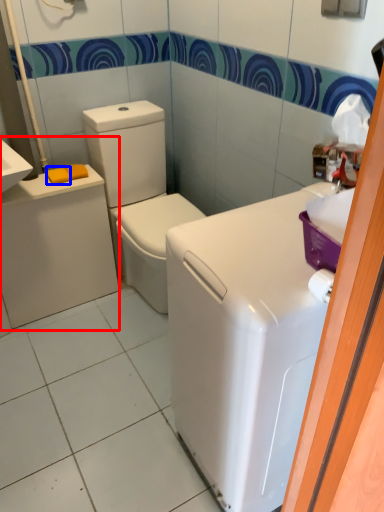
Question: Which object appears closest to the camera in this image, porcelain (highlighted by a red box) or soap (highlighted by a blue box)?

Choices:
 (A) porcelain
 (B) soap

Answer: (A)